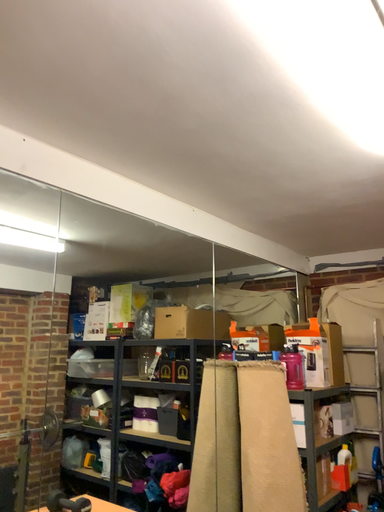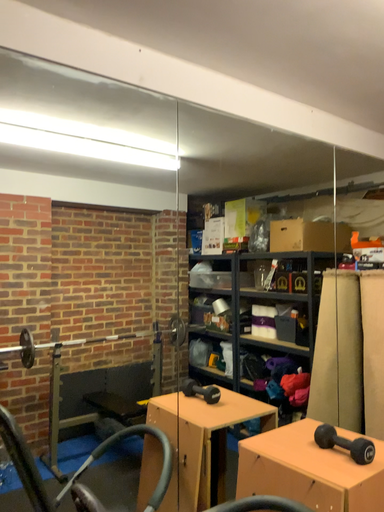
Question: Which way did the camera rotate in the video?

Choices:
 (A) rotated right
 (B) rotated left

Answer: (B)